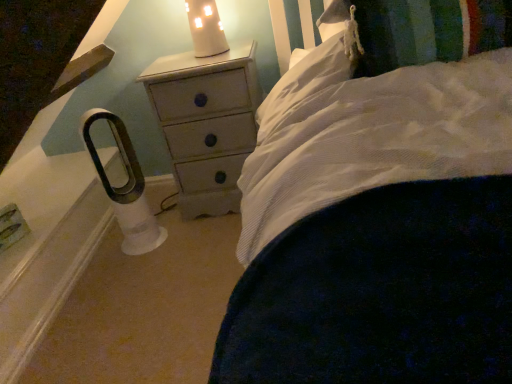
Question: Considering their positions, is white ceramic candle at upper center located in front of or behind white painted wood chest of drawers at center?

Choices:
 (A) behind
 (B) front

Answer: (B)

Question: Does point (202, 33) appear closer or farther from the camera than point (211, 104)?

Choices:
 (A) closer
 (B) farther

Answer: (A)

Question: Which object is positioned farthest from the white ceramic candle at upper center?

Choices:
 (A) white soft pillow at upper right
 (B) white painted wood chest of drawers at center

Answer: (A)

Question: Based on their relative distances, which object is nearer to the white soft pillow at upper right?

Choices:
 (A) white ceramic candle at upper center
 (B) white painted wood chest of drawers at center

Answer: (B)